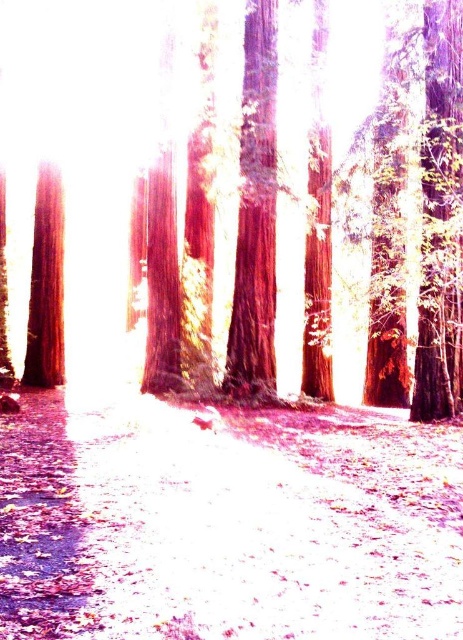
Can you confirm if smooth reddish-brown tree at center is bigger than smooth brown tree trunk at left?

Indeed, smooth reddish-brown tree at center has a larger size compared to smooth brown tree trunk at left.

Is point (386, 320) closer to camera compared to point (43, 240)?

Yes, point (386, 320) is in front of point (43, 240).

Locate an element on the screen. This screenshot has width=463, height=640. smooth reddish-brown tree at center is located at coordinates (337, 211).

Does smooth bark tree at center appear on the right side of smooth brown tree trunk at left?

Yes, smooth bark tree at center is to the right of smooth brown tree trunk at left.

What are the coordinates of `smooth bark tree at center` in the screenshot? It's located at (256, 216).

You are a GUI agent. You are given a task and a screenshot of the screen. Output one action in this format:
    pyautogui.click(x=<x>, y=<y>)
    Task: Click on the smooth bark tree at center
    
    Given the screenshot: What is the action you would take?
    pyautogui.click(x=256, y=216)

Is brown dirt path at center below smooth bark tree at center?

Indeed, brown dirt path at center is positioned under smooth bark tree at center.

Does point (81, 420) come behind point (235, 317)?

No, it is not.

This screenshot has height=640, width=463. Describe the element at coordinates (225, 522) in the screenshot. I see `brown dirt path at center` at that location.

Where is `brown dirt path at center`? brown dirt path at center is located at coordinates (225, 522).